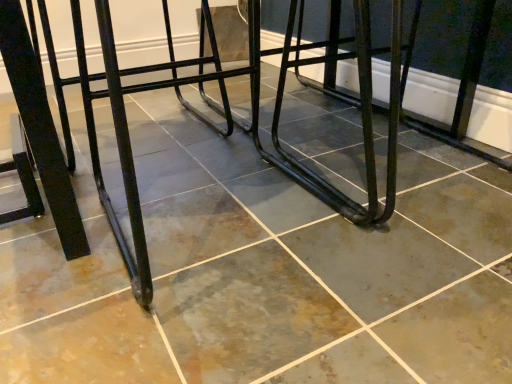
The width and height of the screenshot is (512, 384). I want to click on black metal bar stool at center, so click(x=352, y=104).

The height and width of the screenshot is (384, 512). What do you see at coordinates (352, 104) in the screenshot?
I see `black metal bar stool at center` at bounding box center [352, 104].

Locate an element on the screen. Image resolution: width=512 pixels, height=384 pixels. black metal bar stool at center is located at coordinates (352, 104).